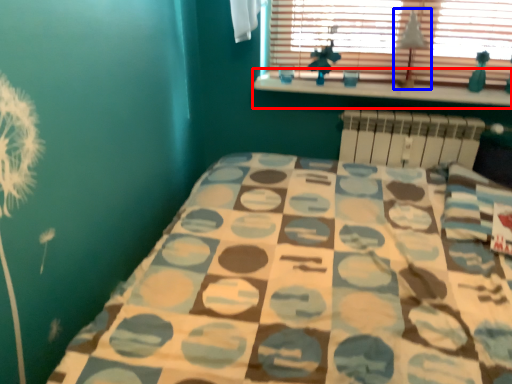
Question: Among these objects, which one is farthest to the camera, window sill (highlighted by a red box) or lamp (highlighted by a blue box)?

Choices:
 (A) window sill
 (B) lamp

Answer: (A)